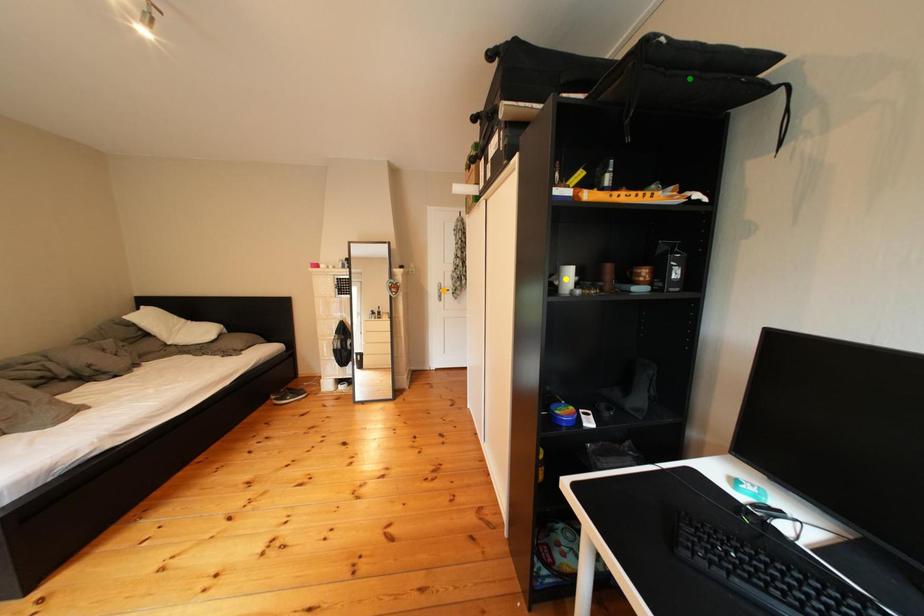
Order these from nearest to farthest:
green point
yellow point
orange point

orange point
yellow point
green point